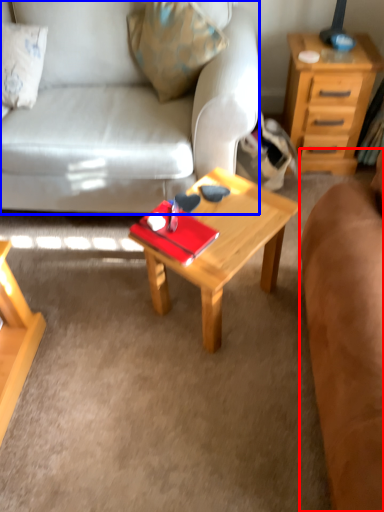
Question: Which object is further to the camera taking this photo, studio couch (highlighted by a red box) or studio couch (highlighted by a blue box)?

Choices:
 (A) studio couch
 (B) studio couch

Answer: (B)